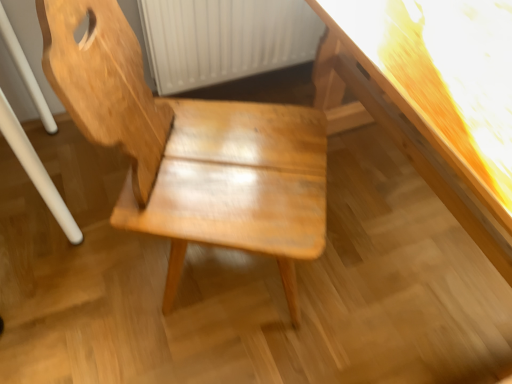
Identify the location of vacant space that is to the left of wooden chair at center. This screenshot has height=384, width=512. (71, 259).